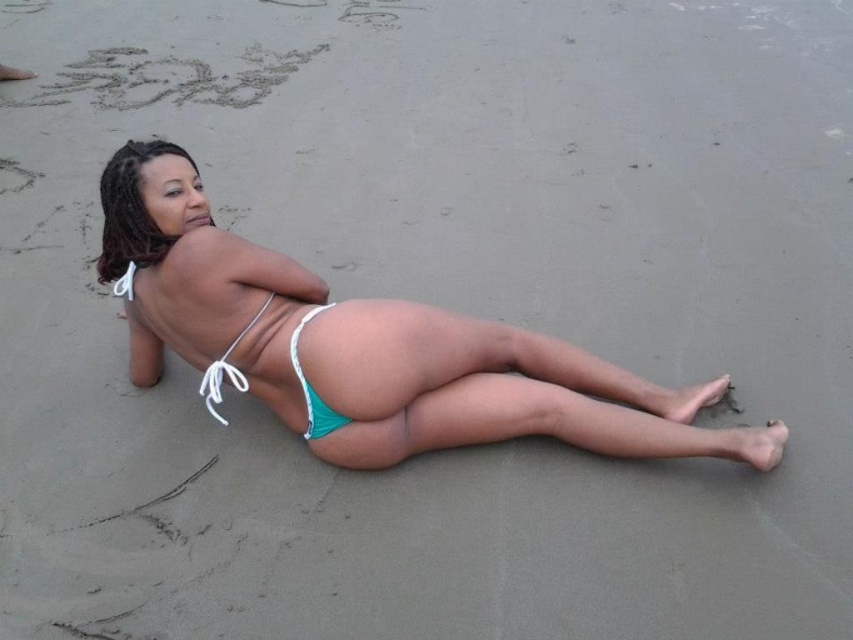
Between teal fabric bikini bottom at center and matte white bikini top at upper left, which one has more height?

teal fabric bikini bottom at center

Does teal fabric bikini bottom at center appear on the left side of matte white bikini top at upper left?

In fact, teal fabric bikini bottom at center is to the right of matte white bikini top at upper left.

Which is behind, point (300, 388) or point (154, 227)?

The point (300, 388) is behind.

Locate an element on the screen. This screenshot has width=853, height=640. teal fabric bikini bottom at center is located at coordinates (495, 392).

From the picture: Who is taller, matte white bikini top at upper left or teal fabric bikini bottom at lower center?

matte white bikini top at upper left

Does matte white bikini top at upper left have a greater height compared to teal fabric bikini bottom at lower center?

Yes, matte white bikini top at upper left is taller than teal fabric bikini bottom at lower center.

In order to click on matte white bikini top at upper left in this screenshot , I will do `click(131, 211)`.

Which is below, teal fabric bikini bottom at center or teal fabric bikini bottom at lower center?

teal fabric bikini bottom at center is lower down.

Does teal fabric bikini bottom at center have a greater width compared to teal fabric bikini bottom at lower center?

Yes.

What do you see at coordinates (495, 392) in the screenshot? This screenshot has height=640, width=853. I see `teal fabric bikini bottom at center` at bounding box center [495, 392].

Locate an element on the screen. The height and width of the screenshot is (640, 853). teal fabric bikini bottom at center is located at coordinates (495, 392).